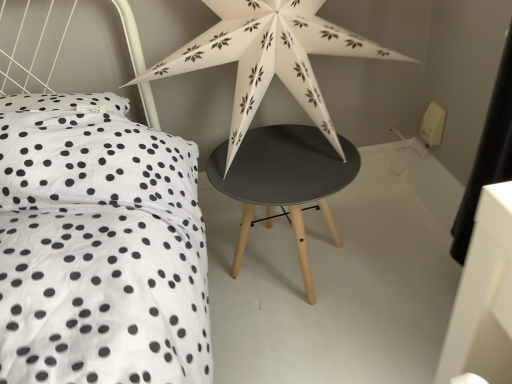
Where is `white paper star at upper center`? white paper star at upper center is located at coordinates (269, 58).

Describe the element at coordinates (269, 58) in the screenshot. This screenshot has width=512, height=384. I see `white paper star at upper center` at that location.

Describe the element at coordinates (284, 180) in the screenshot. I see `matte black stool at center` at that location.

The image size is (512, 384). Identify the location of matte black stool at center. (284, 180).

This screenshot has height=384, width=512. I want to click on white paper star at upper center, so (x=269, y=58).

Is white paper star at upper center at the left side of matte black stool at center?

Indeed, white paper star at upper center is positioned on the left side of matte black stool at center.

Is the position of white paper star at upper center less distant than that of matte black stool at center?

Yes, it is.

Which is in front, point (278, 3) or point (269, 132)?

The point (278, 3) is closer.

From the image's perspective, would you say white paper star at upper center is positioned over matte black stool at center?

Yes, from the image's perspective, white paper star at upper center is above matte black stool at center.

From a real-world perspective, which is physically below, white paper star at upper center or matte black stool at center?

matte black stool at center is physically lower.

Does white paper star at upper center have a lesser width compared to matte black stool at center?

Correct, the width of white paper star at upper center is less than that of matte black stool at center.

Considering the sizes of objects white paper star at upper center and matte black stool at center in the image provided, who is shorter, white paper star at upper center or matte black stool at center?

Standing shorter between the two is matte black stool at center.

Based on their sizes in the image, would you say white paper star at upper center is bigger or smaller than matte black stool at center?

In the image, white paper star at upper center appears to be larger than matte black stool at center.

Does white paper star at upper center contain matte black stool at center?

No, matte black stool at center is not surrounded by white paper star at upper center.

Looking at this image, is white paper star at upper center far away from matte black stool at center?

No.

Does white paper star at upper center turn towards matte black stool at center?

No, white paper star at upper center is not facing towards matte black stool at center.

Can you tell me how much white paper star at upper center and matte black stool at center differ in facing direction?

There is a 2.12-degree angle between the facing directions of white paper star at upper center and matte black stool at center.

Measure the distance from white paper star at upper center to matte black stool at center.

white paper star at upper center is 7.85 inches from matte black stool at center.

Locate an element on the screen. The width and height of the screenshot is (512, 384). stool to the right of white paper star at upper center is located at coordinates (284, 180).

Can you confirm if matte black stool at center is positioned to the right of white paper star at upper center?

Indeed, matte black stool at center is positioned on the right side of white paper star at upper center.

Consider the image. Is the depth of matte black stool at center less than that of white paper star at upper center?

No.

Is point (298, 134) positioned behind point (150, 74)?

Yes, point (298, 134) is farther from viewer.

From the image's perspective, which object appears higher, matte black stool at center or white paper star at upper center?

white paper star at upper center is shown above in the image.

From a real-world perspective, which object stands above the other?

white paper star at upper center, from a real-world perspective.

Considering the sizes of objects matte black stool at center and white paper star at upper center in the image provided, who is thinner, matte black stool at center or white paper star at upper center?

white paper star at upper center.

Can you confirm if matte black stool at center is taller than white paper star at upper center?

No.

Between matte black stool at center and white paper star at upper center, which one has larger size?

With larger size is white paper star at upper center.

Is white paper star at upper center a part of matte black stool at center?

No, matte black stool at center does not contain white paper star at upper center.

Is matte black stool at center beside white paper star at upper center?

No, matte black stool at center is not with white paper star at upper center.

Is matte black stool at center facing towards white paper star at upper center?

No, matte black stool at center is not oriented towards white paper star at upper center.

Locate an element on the screen. The image size is (512, 384). stool below the white paper star at upper center (from the image's perspective) is located at coordinates (284, 180).

I want to click on star in front of the matte black stool at center, so click(269, 58).

This screenshot has width=512, height=384. In order to click on stool behind the white paper star at upper center in this screenshot , I will do pos(284,180).